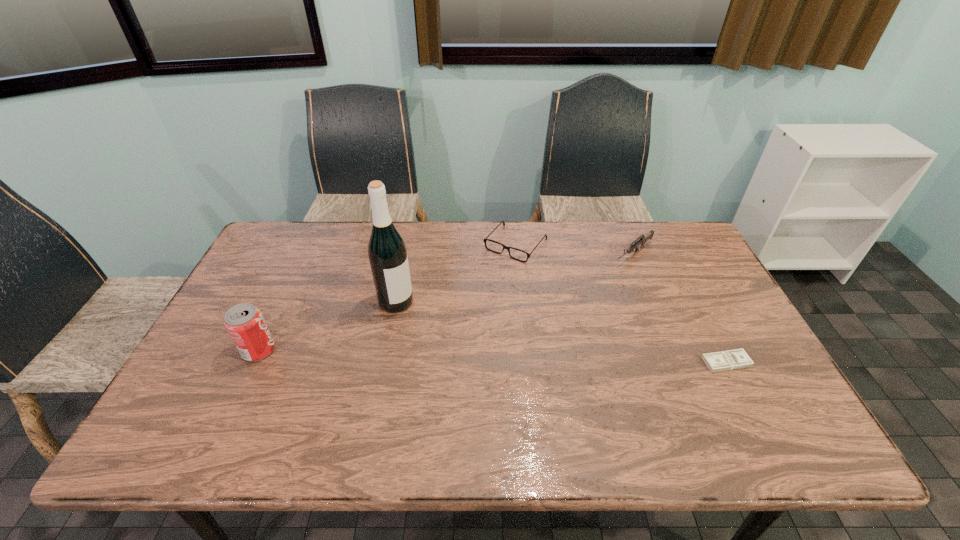
What are the coordinates of `free space between the third shortest object and the third nearest object` in the screenshot? It's located at (515, 278).

Find the location of `unoccupied area between the third shortest object and the spectacles`. unoccupied area between the third shortest object and the spectacles is located at coordinates click(x=575, y=249).

Identify the location of free spot between the gun and the shortest object. This screenshot has width=960, height=540. (680, 308).

Where is `unoccupied position between the money and the fourth tallest object`? unoccupied position between the money and the fourth tallest object is located at coordinates (621, 303).

Identify the location of vacant region between the second object from left to right and the gun. This screenshot has width=960, height=540. (515, 278).

You are a GUI agent. You are given a task and a screenshot of the screen. Output one action in this format:
    pyautogui.click(x=<x>, y=<y>)
    Task: Click on the unoccupied position between the leftmost object and the money
    
    Given the screenshot: What is the action you would take?
    pyautogui.click(x=492, y=356)

This screenshot has height=540, width=960. I want to click on vacant point located between the gun and the spectacles, so click(x=575, y=249).

Locate an element on the screen. This screenshot has width=960, height=540. free space between the gun and the spectacles is located at coordinates (575, 249).

At what (x,y) coordinates should I click in order to perform the action: click on vacant space that's between the gun and the tallest object. Please return your answer as a coordinate pair (x, y). This screenshot has width=960, height=540. Looking at the image, I should click on pos(515,278).

Locate an element on the screen. The width and height of the screenshot is (960, 540). free space between the leftmost object and the money is located at coordinates (492, 356).